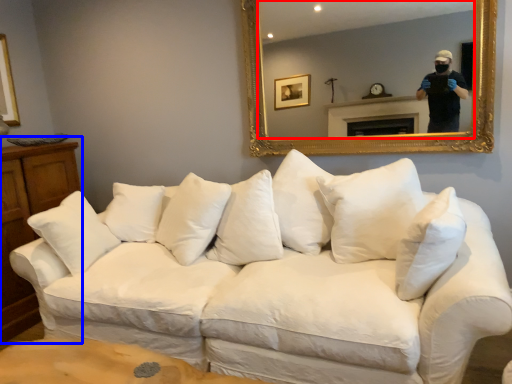
Question: Among these objects, which one is nearest to the camera, mirror (highlighted by a red box) or dresser (highlighted by a blue box)?

Choices:
 (A) mirror
 (B) dresser

Answer: (A)